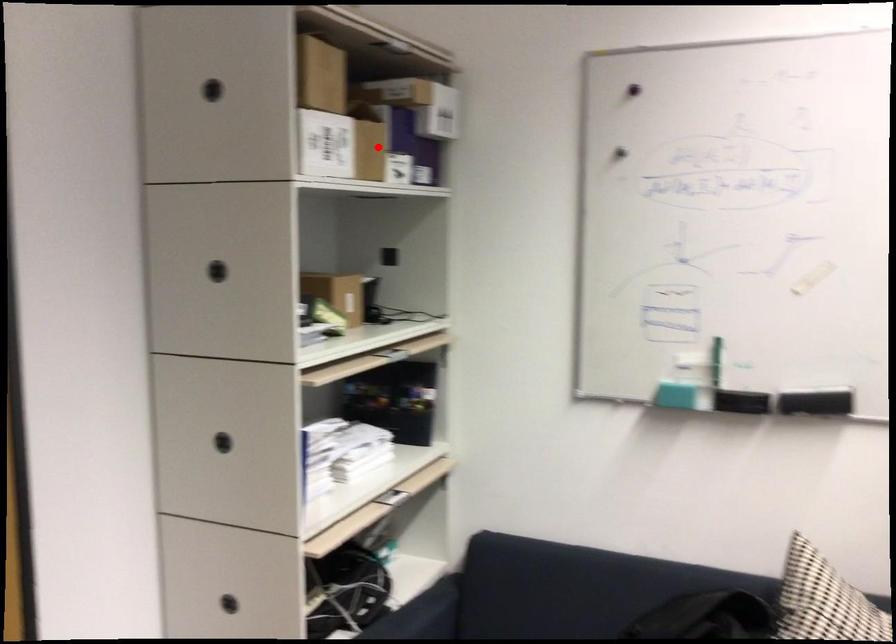
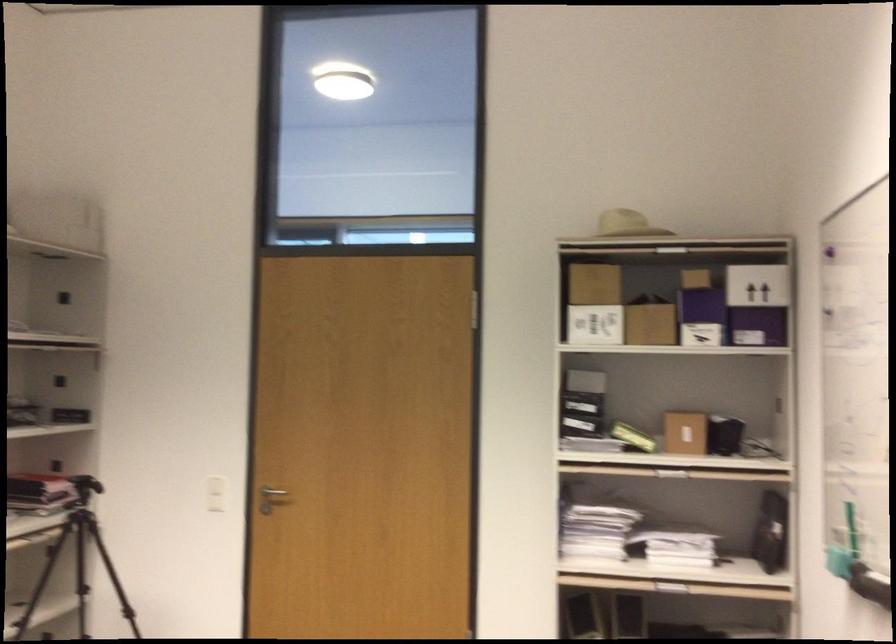
Question: A red point is marked in image1. In image2, is the corresponding 3D point closer to the camera or farther? Reply with the corresponding letter.

Choices:
 (A) The corresponding 3D point is closer.
 (B) The corresponding 3D point is farther.

Answer: (B)